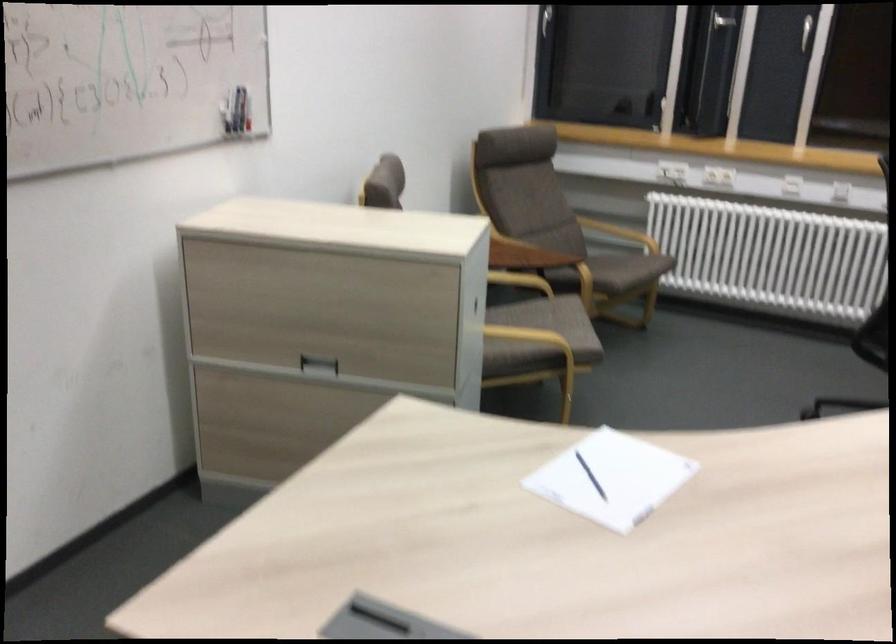
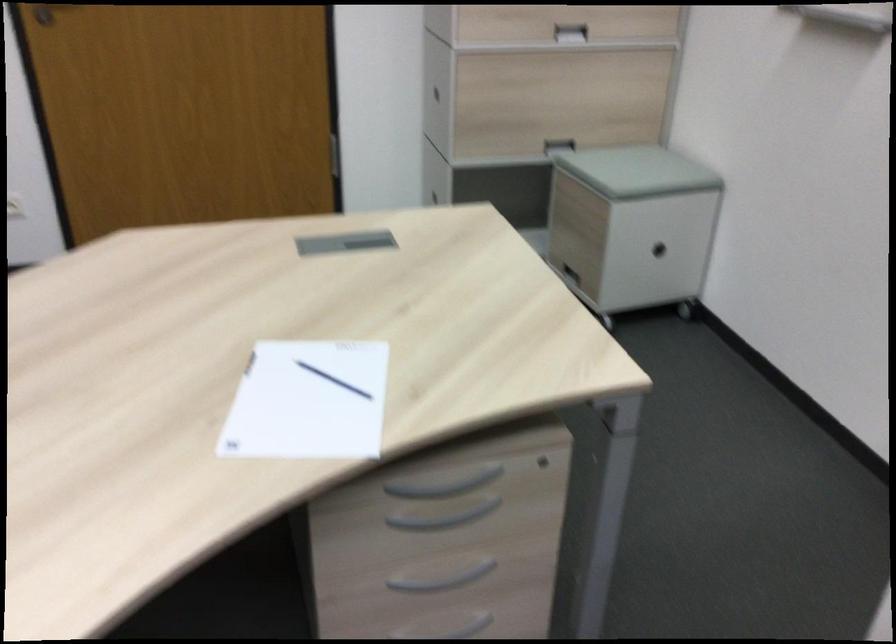
Find the pixel in the second image that matches (x=571, y=489) in the first image.

(333, 380)